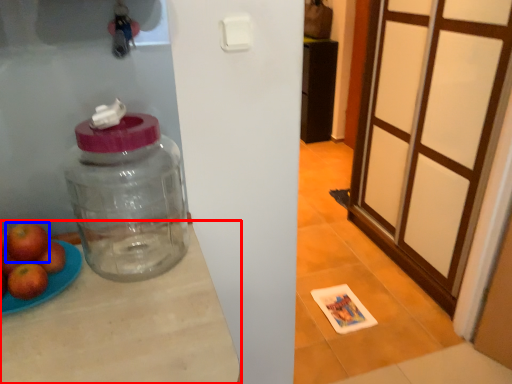
Question: Which point is further to the camera, table (highlighted by a red box) or apple (highlighted by a blue box)?

Choices:
 (A) table
 (B) apple

Answer: (B)